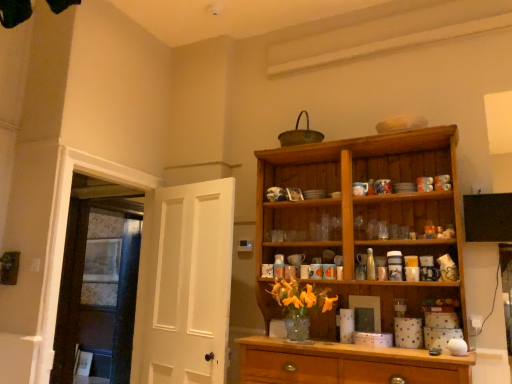
Question: In terms of size, does white wooden door at left, marked as the second door in a right-to-left arrangement, appear bigger or smaller than white matte door at left, marked as the 2th door in a left-to-right arrangement?

Choices:
 (A) small
 (B) big

Answer: (B)

Question: Is point (117, 259) positioned closer to the camera than point (173, 258)?

Choices:
 (A) closer
 (B) farther

Answer: (B)

Question: Which object is positioned closest to the wooden cabinet at right?

Choices:
 (A) white wooden door at left, marked as the second door in a right-to-left arrangement
 (B) white matte door at left, marked as the second door in a back-to-front arrangement

Answer: (B)

Question: Estimate the real-world distances between objects in this image. Which object is farther from the wooden cabinet at right?

Choices:
 (A) white matte door at left, the first door when ordered from front to back
 (B) white wooden door at left, marked as the second door in a right-to-left arrangement

Answer: (B)